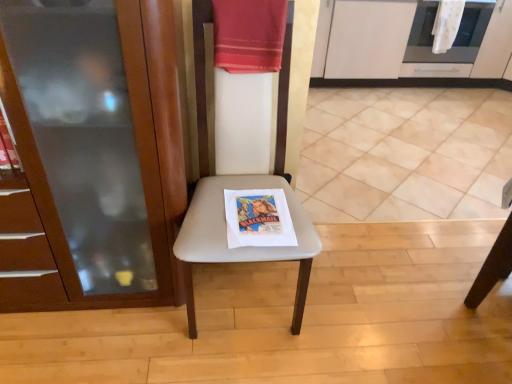
Question: Is stainless steel oven at upper right taller than white textured towel at upper right, the 1th beach towel in the right-to-left sequence?

Choices:
 (A) no
 (B) yes

Answer: (B)

Question: Does stainless steel oven at upper right have a smaller size compared to white textured towel at upper right, the second beach towel in the left-to-right sequence?

Choices:
 (A) yes
 (B) no

Answer: (B)

Question: Would you consider stainless steel oven at upper right to be distant from white textured towel at upper right, the second beach towel in the left-to-right sequence?

Choices:
 (A) no
 (B) yes

Answer: (A)

Question: Are stainless steel oven at upper right and white textured towel at upper right, positioned as the second beach towel in bottom-to-top order, beside each other?

Choices:
 (A) yes
 (B) no

Answer: (B)

Question: Does stainless steel oven at upper right have a lesser width compared to white textured towel at upper right, the first beach towel from the top?

Choices:
 (A) yes
 (B) no

Answer: (B)

Question: Can you confirm if stainless steel oven at upper right is shorter than white textured towel at upper right, the first beach towel from the top?

Choices:
 (A) no
 (B) yes

Answer: (A)

Question: Is the position of beige fabric chair at center less distant than that of white textured towel at upper right, placed as the first beach towel when sorted from back to front?

Choices:
 (A) yes
 (B) no

Answer: (A)

Question: From the image's perspective, is beige fabric chair at center under white textured towel at upper right, the second beach towel from the front?

Choices:
 (A) no
 (B) yes

Answer: (B)

Question: Can you confirm if beige fabric chair at center is bigger than white textured towel at upper right, the 1th beach towel in the right-to-left sequence?

Choices:
 (A) no
 (B) yes

Answer: (B)

Question: Considering the relative positions of beige fabric chair at center and white textured towel at upper right, the 1th beach towel in the right-to-left sequence, in the image provided, is beige fabric chair at center to the right of white textured towel at upper right, the 1th beach towel in the right-to-left sequence, from the viewer's perspective?

Choices:
 (A) no
 (B) yes

Answer: (A)

Question: Does beige fabric chair at center have a greater width compared to white textured towel at upper right, the second beach towel from the front?

Choices:
 (A) no
 (B) yes

Answer: (B)

Question: Is beige fabric chair at center oriented towards white textured towel at upper right, the second beach towel from the front?

Choices:
 (A) no
 (B) yes

Answer: (A)

Question: Is beige fabric chair at center thinner than red cotton towel at upper center, acting as the first beach towel starting from the bottom?

Choices:
 (A) yes
 (B) no

Answer: (B)